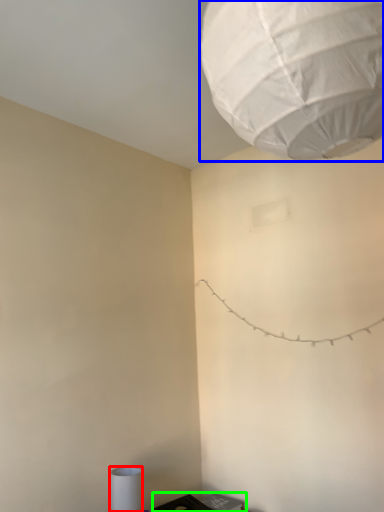
Question: Considering the real-world distances, which object is closest to lamp (highlighted by a red box)? lantern (highlighted by a blue box) or furniture (highlighted by a green box).

Choices:
 (A) lantern
 (B) furniture

Answer: (B)